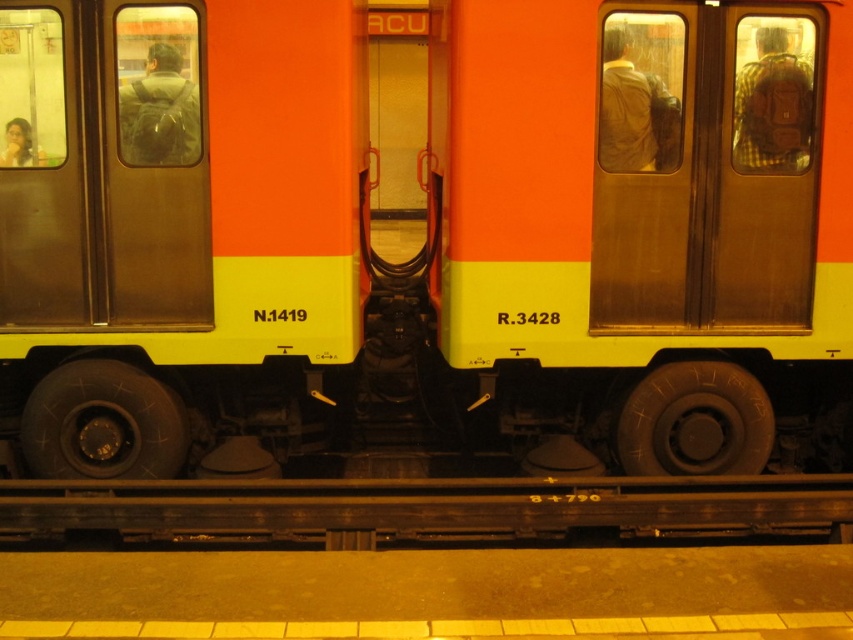
You are a maintenance worker needing to access the undercarriage components of the train. You see the metallic gold door at right and the metal at bottom. Which object should you open or move first to gain access?

You should open or move the metallic gold door at right first because the metal at bottom is behind it, so accessing the undercarriage components would require first accessing the area behind the door.

You are a maintenance worker inspecting the train undercarriage. You notice the metallic gold door at right and the metal at bottom. Which object is positioned higher from the ground?

The metallic gold door at right is located above the metal at bottom, so it is positioned higher from the ground.

You are a photographer taking a close up photo of the train carriages. You have two points marked on your viewfinder at coordinates point (750,198) and point (695,496). Which point is closer to your camera lens?

Point (750,198) is further to the camera than point (695,496), so point (695,496) is closer to the camera lens.